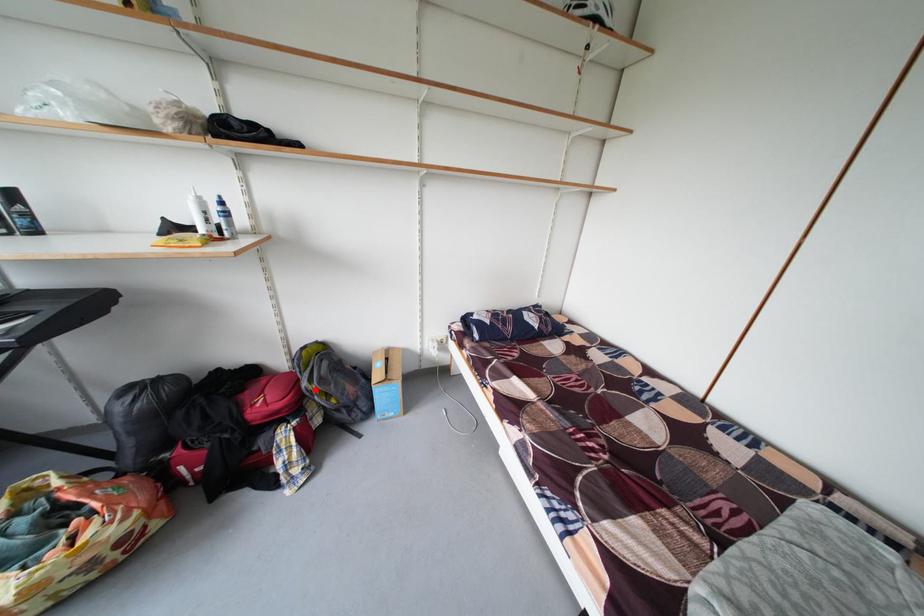
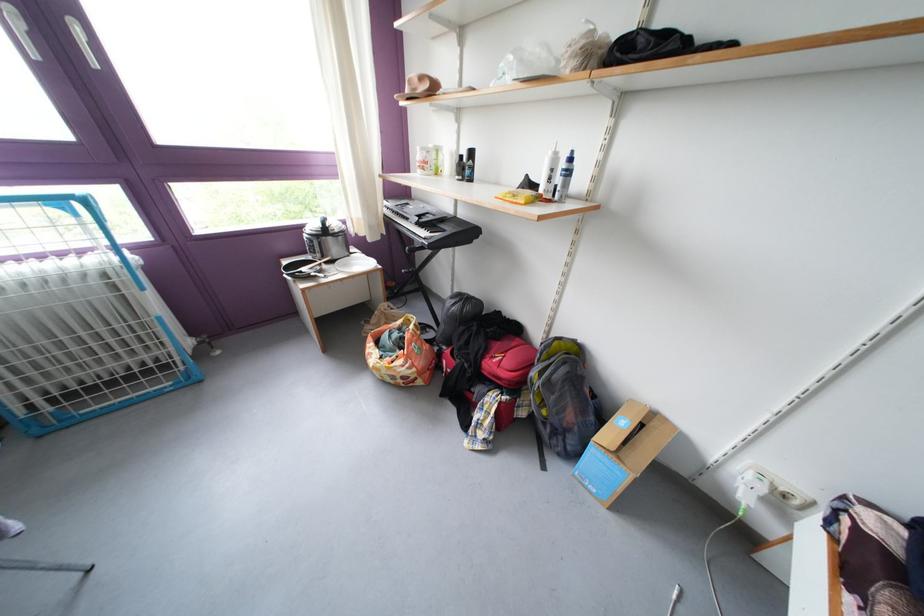
Find the pixel in the second image that matches the highlighted location in the first image.

(543, 379)